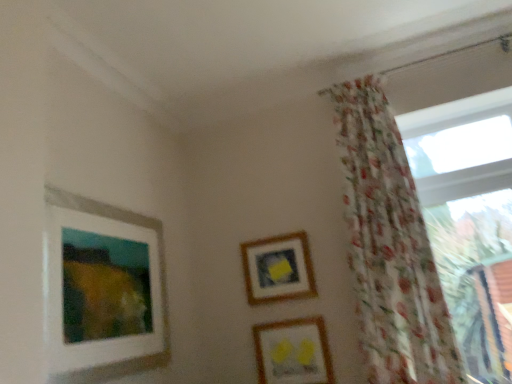
Question: Considering the relative positions of floral sheer curtain at right and matte yellow birds at lower center, arranged as the third picture frame when viewed from the left, in the image provided, is floral sheer curtain at right in front of matte yellow birds at lower center, arranged as the third picture frame when viewed from the left,?

Choices:
 (A) yes
 (B) no

Answer: (A)

Question: Can we say floral sheer curtain at right lies outside matte yellow birds at lower center, which ranks as the first picture frame in right-to-left order?

Choices:
 (A) yes
 (B) no

Answer: (A)

Question: Is floral sheer curtain at right at the left side of matte yellow birds at lower center, arranged as the third picture frame when viewed from the left?

Choices:
 (A) yes
 (B) no

Answer: (B)

Question: From the image's perspective, is floral sheer curtain at right above matte yellow birds at lower center, which ranks as the first picture frame in right-to-left order?

Choices:
 (A) no
 (B) yes

Answer: (B)

Question: Is floral sheer curtain at right bigger than matte yellow birds at lower center, which ranks as the first picture frame in right-to-left order?

Choices:
 (A) no
 (B) yes

Answer: (B)

Question: From a real-world perspective, is floral sheer curtain at right on top of matte yellow birds at lower center, arranged as the third picture frame when viewed from the left?

Choices:
 (A) yes
 (B) no

Answer: (A)

Question: Can you confirm if wooden frame at center, marked as the 2th picture frame in a left-to-right arrangement, is wider than matte yellow birds at lower center, arranged as the third picture frame when viewed from the left?

Choices:
 (A) yes
 (B) no

Answer: (B)

Question: From a real-world perspective, is wooden frame at center, marked as the 2th picture frame in a left-to-right arrangement, on matte yellow birds at lower center, which ranks as the first picture frame in right-to-left order?

Choices:
 (A) yes
 (B) no

Answer: (A)

Question: Considering the relative positions of wooden frame at center, marked as the 2th picture frame in a left-to-right arrangement, and matte yellow birds at lower center, arranged as the third picture frame when viewed from the left, in the image provided, is wooden frame at center, marked as the 2th picture frame in a left-to-right arrangement, behind matte yellow birds at lower center, arranged as the third picture frame when viewed from the left,?

Choices:
 (A) no
 (B) yes

Answer: (B)

Question: Considering the relative sizes of wooden frame at center, positioned as the second picture frame in right-to-left order, and matte yellow birds at lower center, arranged as the third picture frame when viewed from the left, in the image provided, is wooden frame at center, positioned as the second picture frame in right-to-left order, shorter than matte yellow birds at lower center, arranged as the third picture frame when viewed from the left,?

Choices:
 (A) yes
 (B) no

Answer: (B)

Question: Is wooden frame at center, marked as the 2th picture frame in a left-to-right arrangement, taller than matte yellow birds at lower center, arranged as the third picture frame when viewed from the left?

Choices:
 (A) yes
 (B) no

Answer: (A)

Question: Is wooden frame at center, marked as the 2th picture frame in a left-to-right arrangement, thinner than matte yellow birds at lower center, which ranks as the first picture frame in right-to-left order?

Choices:
 (A) yes
 (B) no

Answer: (A)

Question: Is white matte picture frame at upper left, which is the 3th picture frame from right to left, thinner than wooden frame at center, positioned as the second picture frame in right-to-left order?

Choices:
 (A) yes
 (B) no

Answer: (B)